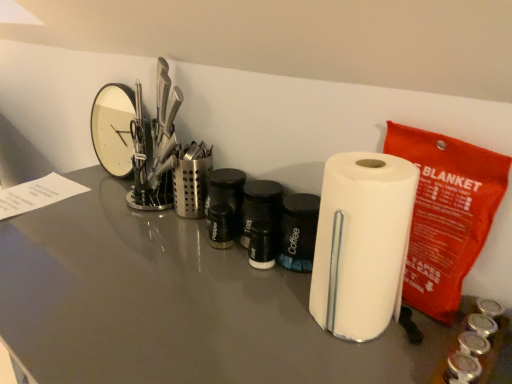
At what (x,y) coordinates should I click in order to perform the action: click on satin silver utensil holder at center, which is the second stationery in right-to-left order. Please return your answer as a coordinate pair (x, y). The width and height of the screenshot is (512, 384). Looking at the image, I should click on (191, 179).

The width and height of the screenshot is (512, 384). What do you see at coordinates (174, 305) in the screenshot?
I see `white glossy paper towel holder at center` at bounding box center [174, 305].

What is the approximate width of white glossy paper towel holder at center?

white glossy paper towel holder at center is 24.08 inches wide.

Find the location of `white matte paper towel at center`. white matte paper towel at center is located at coordinates (362, 243).

Where is `satin silver utensil holder at center, which is counted as the second stationery, starting from the front`? Image resolution: width=512 pixels, height=384 pixels. satin silver utensil holder at center, which is counted as the second stationery, starting from the front is located at coordinates 191,179.

Who is bigger, white matte paper towel at center or satin silver utensil holder at center, which is the second stationery in right-to-left order?

white matte paper towel at center.

In the image, is white matte paper towel at center positioned in front of or behind satin silver utensil holder at center, which is the second stationery in right-to-left order?

white matte paper towel at center is positioned closer to the viewer than satin silver utensil holder at center, which is the second stationery in right-to-left order.

Would you say white matte paper towel at center is inside or outside satin silver utensil holder at center, the 1th stationery viewed from the left?

The correct answer is: outside.

In the scene shown: Is white matte paper towel at center positioned with its back to satin silver utensil holder at center, which is the second stationery in right-to-left order?

white matte paper towel at center does not have its back to satin silver utensil holder at center, which is the second stationery in right-to-left order.

Where is `stationery that is the 2nd object located behind the white glossy paper towel holder at center`? stationery that is the 2nd object located behind the white glossy paper towel holder at center is located at coordinates [x=191, y=179].

Does white glossy paper towel holder at center have a larger size compared to satin silver utensil holder at center, which ranks as the 1th stationery in back-to-front order?

Yes, white glossy paper towel holder at center is bigger than satin silver utensil holder at center, which ranks as the 1th stationery in back-to-front order.

Can we say white glossy paper towel holder at center lies outside satin silver utensil holder at center, which is counted as the second stationery, starting from the front?

Yes.

Can you tell me how much white glossy paper towel holder at center and satin silver utensil holder at center, the 1th stationery viewed from the left, differ in facing direction?

The angle between the facing direction of white glossy paper towel holder at center and the facing direction of satin silver utensil holder at center, the 1th stationery viewed from the left, is 1.22 degrees.

Which is more to the left, white matte paper towel at center or white paper towel at right, arranged as the first stationery when viewed from the right?

white matte paper towel at center is more to the left.

Which of these two, white matte paper towel at center or white paper towel at right, the 1th stationery from the front, is thinner?

With smaller width is white paper towel at right, the 1th stationery from the front.

Between point (318, 279) and point (420, 231), which one is positioned in front?

Point (318, 279)

Looking at the image, does white matte paper towel at center seem bigger or smaller compared to white paper towel at right, the 1th stationery from the front?

Clearly, white matte paper towel at center is larger in size than white paper towel at right, the 1th stationery from the front.

Does point (473, 148) lie behind point (332, 262)?

No, it is in front of (332, 262).

In terms of width, does white paper towel at right, the 1th stationery from the front, look wider or thinner when compared to white matte paper towel at center?

Clearly, white paper towel at right, the 1th stationery from the front, has less width compared to white matte paper towel at center.

Can you confirm if white paper towel at right, the 1th stationery from the front, is smaller than white matte paper towel at center?

Correct, white paper towel at right, the 1th stationery from the front, occupies less space than white matte paper towel at center.

The height and width of the screenshot is (384, 512). What are the coordinates of `stationery above the white matte paper towel at center (from a real-world perspective)` in the screenshot? It's located at (446, 214).

Find the location of a particular element. The image size is (512, 384). counter top on the left side of white matte paper towel at center is located at coordinates (174, 305).

From a real-world perspective, which is physically below, white glossy paper towel holder at center or white matte paper towel at center?

From a 3D spatial view, white glossy paper towel holder at center is below.

Consider the image. Does white glossy paper towel holder at center come behind white matte paper towel at center?

No, it is in front of white matte paper towel at center.

Which is less distant, (201,143) or (419,240)?

Point (201,143) is farther from the camera than point (419,240).

From a real-world perspective, which is physically above, satin silver utensil holder at center, the 1th stationery viewed from the left, or white paper towel at right, the 1th stationery from the front?

white paper towel at right, the 1th stationery from the front.

Considering the positions of objects satin silver utensil holder at center, the 1th stationery viewed from the left, and white paper towel at right, arranged as the first stationery when viewed from the right, in the image provided, who is more to the right, satin silver utensil holder at center, the 1th stationery viewed from the left, or white paper towel at right, arranged as the first stationery when viewed from the right,?

Positioned to the right is white paper towel at right, arranged as the first stationery when viewed from the right.

In the scene shown: Is satin silver utensil holder at center, which ranks as the 1th stationery in back-to-front order, oriented away from white paper towel at right, arranged as the first stationery when viewed from the right?

satin silver utensil holder at center, which ranks as the 1th stationery in back-to-front order, is not turned away from white paper towel at right, arranged as the first stationery when viewed from the right.

Is white glossy paper towel holder at center facing away from white paper towel at right, the 2th stationery when ordered from back to front?

white glossy paper towel holder at center does not have its back to white paper towel at right, the 2th stationery when ordered from back to front.

Is white glossy paper towel holder at center beside white paper towel at right, the 2th stationery when ordered from back to front?

white glossy paper towel holder at center and white paper towel at right, the 2th stationery when ordered from back to front, are clearly separated.

Which point is more forward, [77,341] or [411,305]?

Point [77,341]

Which object is wider, white glossy paper towel holder at center or white paper towel at right, the 2th stationery when ordered from back to front?

white glossy paper towel holder at center.

I want to click on paper towel in front of the satin silver utensil holder at center, which is the second stationery in right-to-left order, so click(x=362, y=243).

Find the location of a particular element. counter top on the left side of satin silver utensil holder at center, the 1th stationery viewed from the left is located at coordinates (174, 305).

Looking at the image, which one is located further to white matte paper towel at center, white paper towel at right, the 1th stationery from the front, or white glossy paper towel holder at center?

Based on the image, white glossy paper towel holder at center appears to be further to white matte paper towel at center.

Looking at the image, which one is located closer to satin silver utensil holder at center, which ranks as the 1th stationery in back-to-front order, white paper towel at right, arranged as the first stationery when viewed from the right, or white matte paper towel at center?

Based on the image, white matte paper towel at center appears to be nearer to satin silver utensil holder at center, which ranks as the 1th stationery in back-to-front order.

Which object lies further to the anchor point white glossy paper towel holder at center, white matte paper towel at center or satin silver utensil holder at center, the 1th stationery viewed from the left?

satin silver utensil holder at center, the 1th stationery viewed from the left.

Looking at the image, which one is located closer to white glossy paper towel holder at center, white paper towel at right, the 2th stationery when ordered from back to front, or satin silver utensil holder at center, which is counted as the second stationery, starting from the front?

satin silver utensil holder at center, which is counted as the second stationery, starting from the front, is positioned closer to the anchor white glossy paper towel holder at center.

When comparing their distances from white matte paper towel at center, does white paper towel at right, arranged as the first stationery when viewed from the right, or satin silver utensil holder at center, which ranks as the 1th stationery in back-to-front order, seem closer?

white paper towel at right, arranged as the first stationery when viewed from the right, lies closer to white matte paper towel at center than the other object.

Based on their spatial positions, is satin silver utensil holder at center, which is the second stationery in right-to-left order, or white glossy paper towel holder at center closer to white matte paper towel at center?

The object closer to white matte paper towel at center is white glossy paper towel holder at center.

Based on their spatial positions, is white glossy paper towel holder at center or white matte paper towel at center closer to satin silver utensil holder at center, which is the second stationery in right-to-left order?

white glossy paper towel holder at center is positioned closer to the anchor satin silver utensil holder at center, which is the second stationery in right-to-left order.

Considering their positions, is white matte paper towel at center positioned further to satin silver utensil holder at center, the 1th stationery viewed from the left, than white paper towel at right, arranged as the first stationery when viewed from the right?

Based on the image, white paper towel at right, arranged as the first stationery when viewed from the right, appears to be further to satin silver utensil holder at center, the 1th stationery viewed from the left.

You are a GUI agent. You are given a task and a screenshot of the screen. Output one action in this format:
    pyautogui.click(x=<x>, y=<y>)
    Task: Click on the paper towel between satin silver utensil holder at center, which is counted as the second stationery, starting from the front, and white paper towel at right, the 2th stationery when ordered from back to front, from left to right
    Image resolution: width=512 pixels, height=384 pixels.
    Given the screenshot: What is the action you would take?
    pyautogui.click(x=362, y=243)

The image size is (512, 384). I want to click on paper towel between white glossy paper towel holder at center and white paper towel at right, the 1th stationery from the front, from left to right, so click(x=362, y=243).

The height and width of the screenshot is (384, 512). In order to click on stationery located between white glossy paper towel holder at center and satin silver utensil holder at center, the 1th stationery viewed from the left, in the depth direction in this screenshot , I will do `click(446, 214)`.

The width and height of the screenshot is (512, 384). Identify the location of paper towel located between white glossy paper towel holder at center and satin silver utensil holder at center, the 1th stationery viewed from the left, in the depth direction. (362, 243).